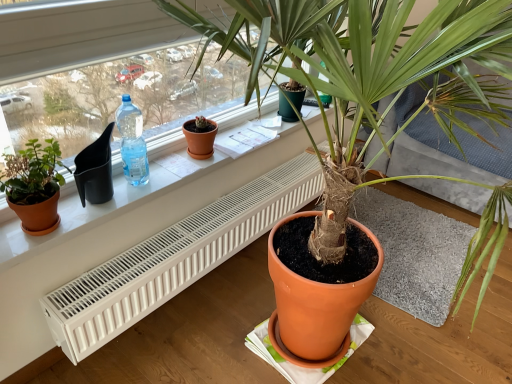
Question: Can we say white plastic radiator at lower center lies outside translucent plastic bottle at window left?

Choices:
 (A) yes
 (B) no

Answer: (A)

Question: Does white plastic radiator at lower center have a greater height compared to translucent plastic bottle at window left?

Choices:
 (A) no
 (B) yes

Answer: (A)

Question: Does white plastic radiator at lower center have a greater width compared to translucent plastic bottle at window left?

Choices:
 (A) no
 (B) yes

Answer: (B)

Question: Does white plastic radiator at lower center contain translucent plastic bottle at window left?

Choices:
 (A) no
 (B) yes

Answer: (A)

Question: From a real-world perspective, is white plastic radiator at lower center beneath translucent plastic bottle at window left?

Choices:
 (A) no
 (B) yes

Answer: (B)

Question: Relative to white plastic radiator at lower center, is terracotta clay pot at center in front or behind?

Choices:
 (A) behind
 (B) front

Answer: (A)

Question: Does point click(x=201, y=142) appear closer or farther from the camera than point click(x=83, y=337)?

Choices:
 (A) closer
 (B) farther

Answer: (B)

Question: From a real-world perspective, is terracotta clay pot at center above or below white plastic radiator at lower center?

Choices:
 (A) below
 (B) above

Answer: (B)

Question: Is terracotta clay pot at center wider or thinner than white plastic radiator at lower center?

Choices:
 (A) thin
 (B) wide

Answer: (A)

Question: In terms of height, does matte white radiator at lower center look taller or shorter compared to matte black pot at upper left?

Choices:
 (A) short
 (B) tall

Answer: (A)

Question: In the image, is matte white radiator at lower center positioned in front of or behind matte black pot at upper left?

Choices:
 (A) behind
 (B) front

Answer: (A)

Question: Would you say matte white radiator at lower center is inside or outside matte black pot at upper left?

Choices:
 (A) inside
 (B) outside

Answer: (B)

Question: Based on their positions, is matte white radiator at lower center located to the left or right of matte black pot at upper left?

Choices:
 (A) left
 (B) right

Answer: (B)

Question: Is translucent plastic bottle at window left in front of or behind matte terracotta pot at left, the first houseplant in the back-to-front sequence, in the image?

Choices:
 (A) front
 (B) behind

Answer: (B)

Question: From the image's perspective, is translucent plastic bottle at window left located above or below matte terracotta pot at left, the first houseplant in the back-to-front sequence?

Choices:
 (A) above
 (B) below

Answer: (A)